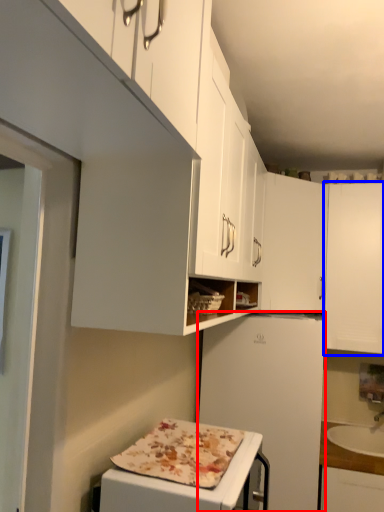
Question: Among these objects, which one is nearest to the camera, refrigerator (highlighted by a red box) or cabinetry (highlighted by a blue box)?

Choices:
 (A) refrigerator
 (B) cabinetry

Answer: (A)